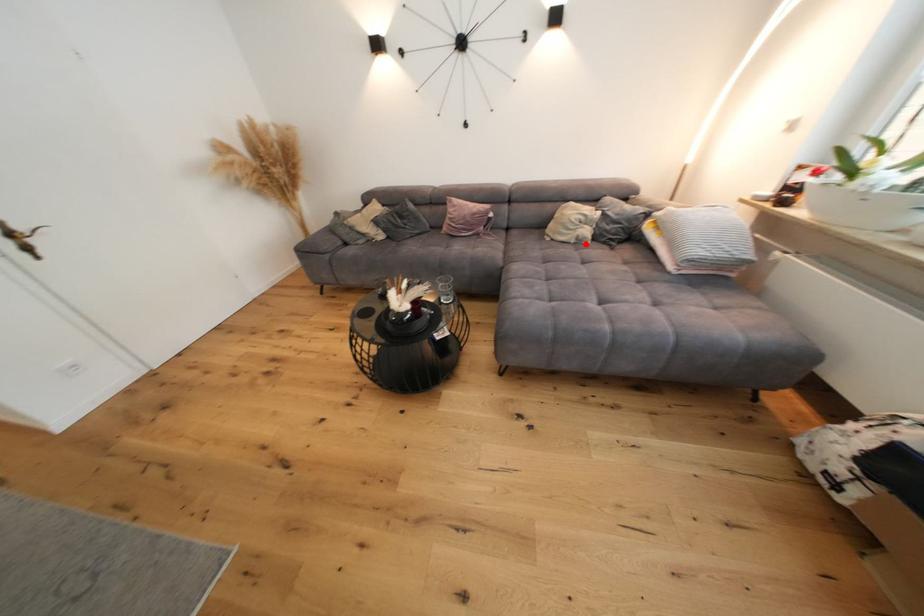
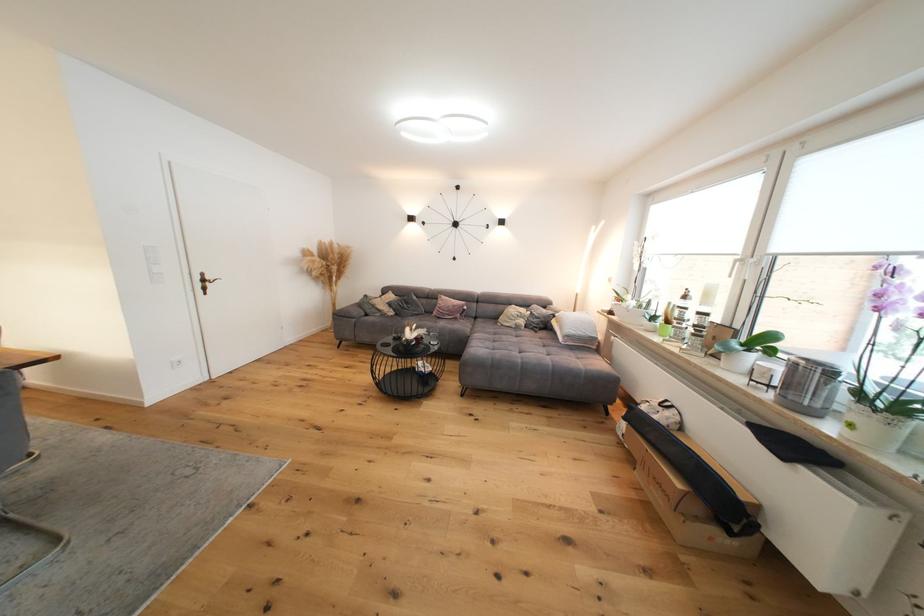
The point at the highlighted location is marked in the first image. Where is the corresponding point in the second image?

(524, 330)